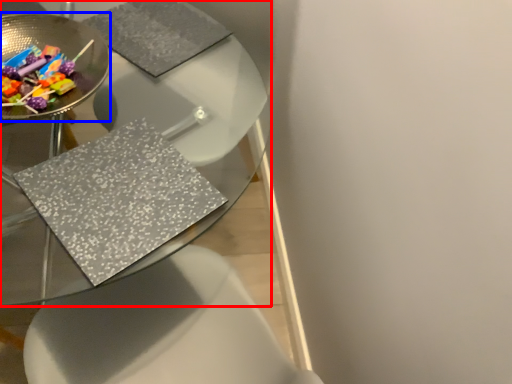
Question: Which object appears closest to the camera in this image, table (highlighted by a red box) or glass plate (highlighted by a blue box)?

Choices:
 (A) table
 (B) glass plate

Answer: (A)